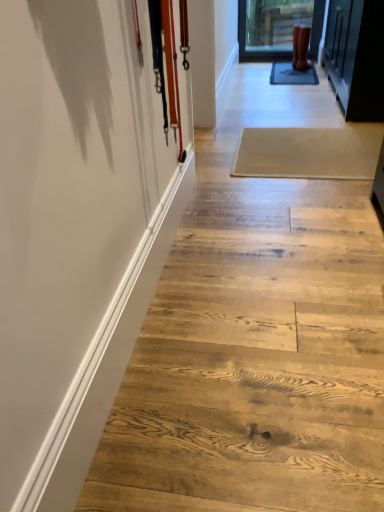
Question: Does white glossy barn door at left appear on the left side of beige wood plank at center?

Choices:
 (A) no
 (B) yes

Answer: (B)

Question: Is the depth of white glossy barn door at left less than that of beige wood plank at center?

Choices:
 (A) no
 (B) yes

Answer: (B)

Question: Does white glossy barn door at left appear on the right side of beige wood plank at center?

Choices:
 (A) no
 (B) yes

Answer: (A)

Question: Can you confirm if white glossy barn door at left is taller than beige wood plank at center?

Choices:
 (A) no
 (B) yes

Answer: (B)

Question: From the image's perspective, is white glossy barn door at left below beige wood plank at center?

Choices:
 (A) no
 (B) yes

Answer: (B)

Question: Considering the relative sizes of white glossy barn door at left and beige wood plank at center in the image provided, is white glossy barn door at left smaller than beige wood plank at center?

Choices:
 (A) yes
 (B) no

Answer: (A)

Question: From the image's perspective, would you say rubber matte boots at upper right is positioned over beige wood plank at center?

Choices:
 (A) yes
 (B) no

Answer: (A)

Question: Is rubber matte boots at upper right taller than beige wood plank at center?

Choices:
 (A) yes
 (B) no

Answer: (A)

Question: From a real-world perspective, does rubber matte boots at upper right stand above beige wood plank at center?

Choices:
 (A) yes
 (B) no

Answer: (A)

Question: Is rubber matte boots at upper right bigger than beige wood plank at center?

Choices:
 (A) yes
 (B) no

Answer: (B)

Question: Is rubber matte boots at upper right positioned behind beige wood plank at center?

Choices:
 (A) yes
 (B) no

Answer: (A)

Question: Is rubber matte boots at upper right in contact with beige wood plank at center?

Choices:
 (A) yes
 (B) no

Answer: (B)

Question: Is rubber matte boots at upper right completely or partially outside of white glossy barn door at left?

Choices:
 (A) no
 (B) yes

Answer: (B)